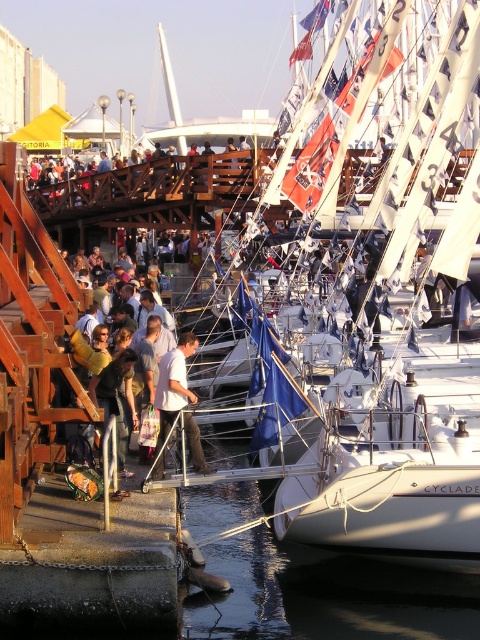
Is point (80, 328) positioned in front of point (93, 396)?

No, it is behind (93, 396).

Who is lower down, light brown leather jacket at center or dark blue jeans at center?

Positioned lower is dark blue jeans at center.

Is point (152, 314) farther from camera compared to point (121, 355)?

Yes, point (152, 314) is farther from viewer.

At what (x,y) coordinates should I click in order to perform the action: click on light brown leather jacket at center. Please return your answer as a coordinate pair (x, y). The width and height of the screenshot is (480, 640). Looking at the image, I should click on (144, 317).

Between white cotton shirt at center and light brown leather jacket at center, which one has less height?

white cotton shirt at center

Is point (170, 371) farther from camera compared to point (120, 296)?

No, (170, 371) is in front of (120, 296).

This screenshot has width=480, height=640. What do you see at coordinates (171, 392) in the screenshot?
I see `white cotton shirt at center` at bounding box center [171, 392].

The height and width of the screenshot is (640, 480). Find the location of `white cotton shirt at center`. white cotton shirt at center is located at coordinates (171, 392).

Who is shorter, white cotton shirt at center or dark blue jeans at center?

With less height is dark blue jeans at center.

Who is more distant from viewer, (187, 444) or (91, 396)?

The point (91, 396) is more distant.

Find the location of `white cotton shirt at center`. white cotton shirt at center is located at coordinates (171, 392).

At what (x,y) coordinates should I click in order to perform the action: click on white cotton shirt at center. Please return your answer as a coordinate pair (x, y). Looking at the image, I should click on (171, 392).